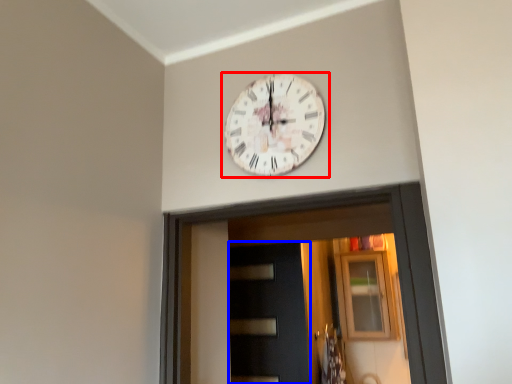
Question: Which of the following is the farthest to the observer, wall clock (highlighted by a red box) or door (highlighted by a blue box)?

Choices:
 (A) wall clock
 (B) door

Answer: (B)